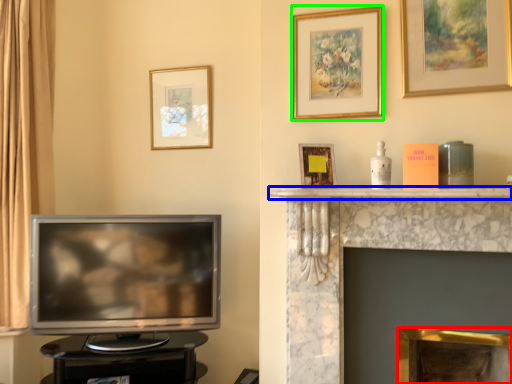
Question: Based on their relative distances, which object is nearer to fireplace (highlighted by a red box)? Choose from mantle (highlighted by a blue box) and picture frame (highlighted by a green box).

Choices:
 (A) mantle
 (B) picture frame

Answer: (A)